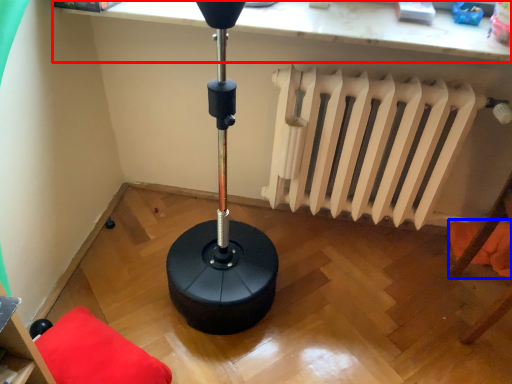
Question: Which object is closer to the camera taking this photo, computer (highlighted by a red box) or pillow (highlighted by a blue box)?

Choices:
 (A) computer
 (B) pillow

Answer: (A)